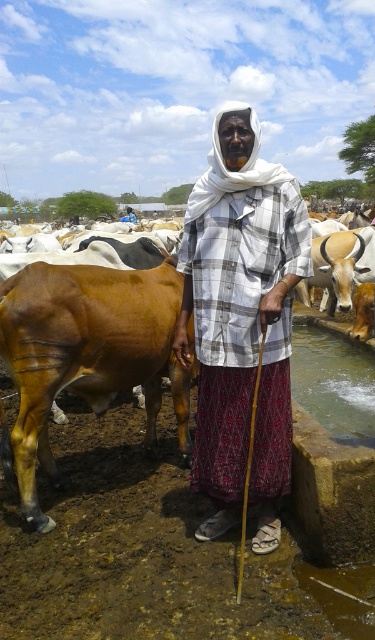
You are a photographer trying to capture the scene of the man and the bull. You want to ensure that both the white checkered shirt at center and the brown glossy bull at left are clearly visible in your photo. Based on their heights, which one should you focus on first to ensure proper focus?

The white checkered shirt at center has a greater height compared to the brown glossy bull at left, so you should focus on the white checkered shirt at center first to ensure proper focus.

You are a photographer trying to capture the scene with a camera that has a limited field of view. You want to include both the white checkered shirt at center and the brown glossy bull at left in the frame. Based on their sizes, which object should you focus on to ensure both are visible without zooming in too much?

The white checkered shirt at center is smaller than the brown glossy bull at left, so focusing on the brown glossy bull at left would allow the smaller shirt to fit within the frame without excessive zooming.

You are a photographer trying to capture the man in the white checkered shirt at center and the brown glossy bull at left in the same frame. Based on their positions, which one would appear closer to the bottom of the photo?

The brown glossy bull at left appears closer to the bottom of the photo because the white checkered shirt at center is above it.